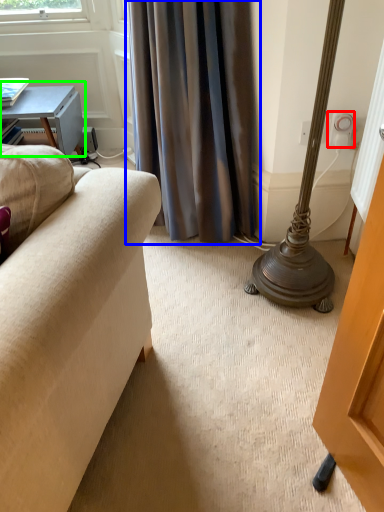
Question: Which object is positioned closest to electric outlet (highlighted by a red box)? Select from curtain (highlighted by a blue box) and table (highlighted by a green box).

Choices:
 (A) curtain
 (B) table

Answer: (A)